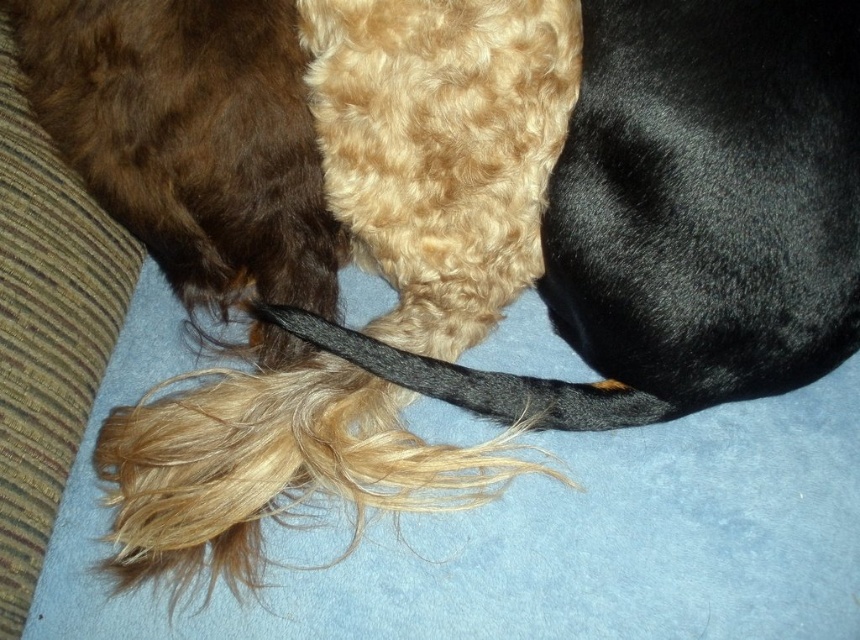
Which is more to the left, brown fuzzy fur at upper left or black silky tail at center?

Positioned to the left is brown fuzzy fur at upper left.

Is brown fuzzy fur at upper left closer to the viewer compared to black silky tail at center?

Yes, brown fuzzy fur at upper left is closer to the viewer.

Is point (204, 58) behind point (514, 387)?

No, it is not.

Locate an element on the screen. brown fuzzy fur at upper left is located at coordinates (191, 138).